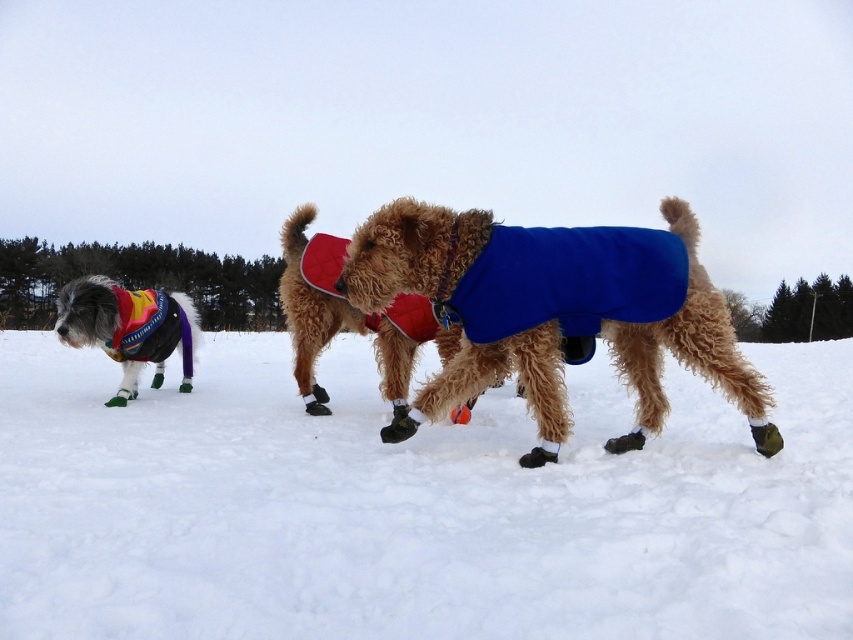
Question: Estimate the real-world distances between objects in this image. Which object is closer to the multicolored knitted sweater at left?

Choices:
 (A) white fluffy snow at center
 (B) blue fleece coat at center

Answer: (A)

Question: Which is farther from the white fluffy snow at center?

Choices:
 (A) blue fleece coat at center
 (B) multicolored knitted sweater at left

Answer: (A)

Question: Which of the following is the closest to the observer?

Choices:
 (A) (x=808, y=600)
 (B) (x=154, y=349)

Answer: (A)

Question: In this image, where is white fluffy snow at center located relative to multicolored knitted sweater at left?

Choices:
 (A) left
 (B) right

Answer: (B)

Question: Is white fluffy snow at center smaller than multicolored knitted sweater at left?

Choices:
 (A) yes
 (B) no

Answer: (B)

Question: Does white fluffy snow at center appear on the right side of multicolored knitted sweater at left?

Choices:
 (A) yes
 (B) no

Answer: (A)